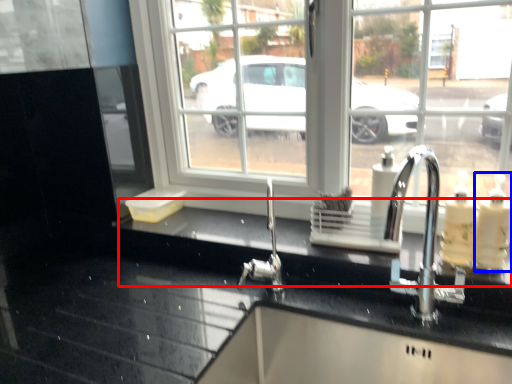
Question: Which point is further to the camera, counter top (highlighted by a red box) or soap dispenser (highlighted by a blue box)?

Choices:
 (A) counter top
 (B) soap dispenser

Answer: (A)